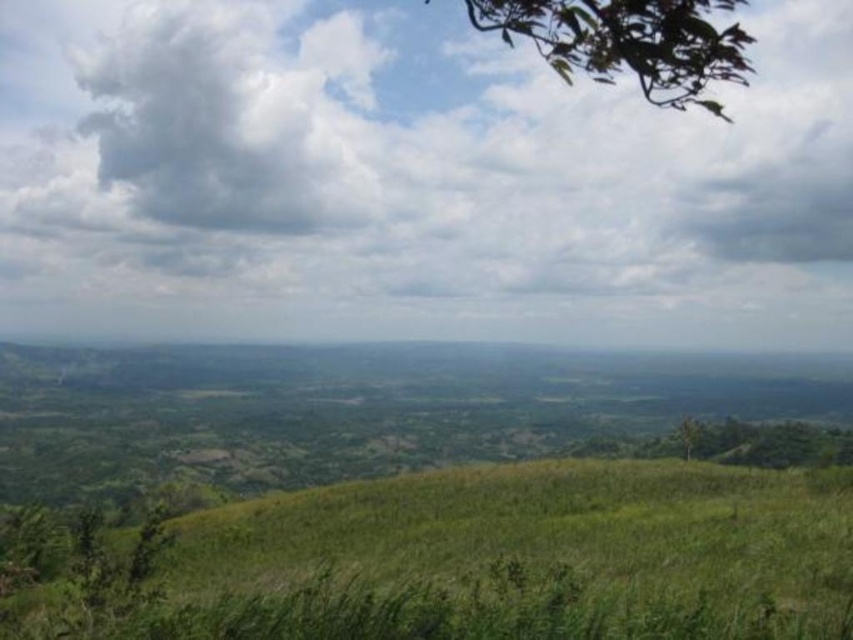
Which is more to the right, green grassy hill at lower center or white fluffy cloud at upper left?

green grassy hill at lower center

Does green grassy hill at lower center have a smaller size compared to white fluffy cloud at upper left?

Yes, green grassy hill at lower center is smaller than white fluffy cloud at upper left.

Is point (230, 632) farther from viewer compared to point (306, 202)?

No, (230, 632) is in front of (306, 202).

Image resolution: width=853 pixels, height=640 pixels. Find the location of `green grassy hill at lower center`. green grassy hill at lower center is located at coordinates (463, 560).

Does point (788, 104) come in front of point (575, 525)?

No, it is behind (575, 525).

Is white fluffy cloud at upper center smaller than green grassy hill at lower center?

Actually, white fluffy cloud at upper center might be larger than green grassy hill at lower center.

Identify the location of white fluffy cloud at upper center. Image resolution: width=853 pixels, height=640 pixels. (412, 180).

Who is shorter, white fluffy cloud at upper center or white fluffy cloud at upper left?

white fluffy cloud at upper left is shorter.

What do you see at coordinates (412, 180) in the screenshot? The image size is (853, 640). I see `white fluffy cloud at upper center` at bounding box center [412, 180].

Identify the location of white fluffy cloud at upper center. (412, 180).